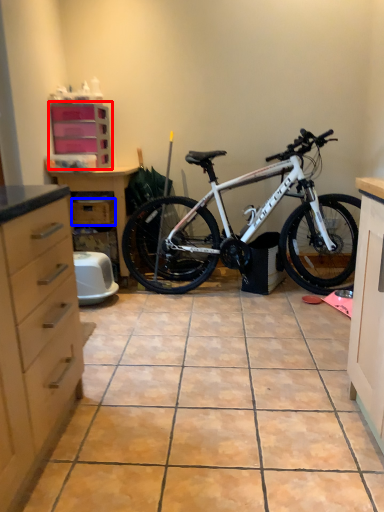
Question: Among these objects, which one is nearest to the camera, cabinetry (highlighted by a red box) or drawer (highlighted by a blue box)?

Choices:
 (A) cabinetry
 (B) drawer

Answer: (A)